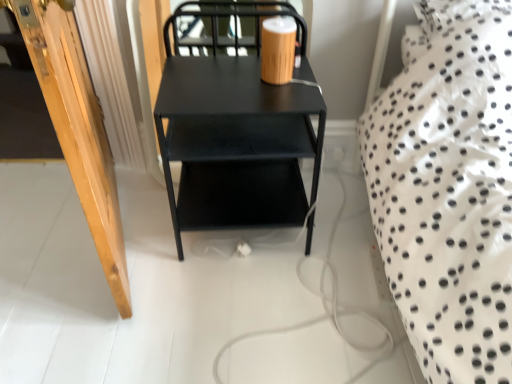
Question: Is wooden door at left facing towards matte black table at center?

Choices:
 (A) no
 (B) yes

Answer: (A)

Question: Does wooden door at left lie behind matte black table at center?

Choices:
 (A) no
 (B) yes

Answer: (A)

Question: From the image's perspective, would you say wooden door at left is positioned over matte black table at center?

Choices:
 (A) yes
 (B) no

Answer: (A)

Question: Is wooden door at left to the right of matte black table at center from the viewer's perspective?

Choices:
 (A) no
 (B) yes

Answer: (A)

Question: Is wooden door at left positioned with its back to matte black table at center?

Choices:
 (A) yes
 (B) no

Answer: (B)

Question: Considering the relative positions of wooden door at left and matte black table at center in the image provided, is wooden door at left to the left of matte black table at center from the viewer's perspective?

Choices:
 (A) no
 (B) yes

Answer: (B)

Question: Is wooden door at left at the back of matte black table at center?

Choices:
 (A) no
 (B) yes

Answer: (A)

Question: Is the surface of matte black table at center in direct contact with wooden door at left?

Choices:
 (A) no
 (B) yes

Answer: (A)

Question: Is the depth of matte black table at center less than that of wooden door at left?

Choices:
 (A) yes
 (B) no

Answer: (B)

Question: Is matte black table at center positioned far away from wooden door at left?

Choices:
 (A) yes
 (B) no

Answer: (B)

Question: Could you tell me if matte black table at center is turned towards wooden door at left?

Choices:
 (A) yes
 (B) no

Answer: (B)

Question: Would you say matte black table at center is outside wooden door at left?

Choices:
 (A) no
 (B) yes

Answer: (B)

Question: Is matte black table at center wider or thinner than wooden door at left?

Choices:
 (A) thin
 (B) wide

Answer: (A)